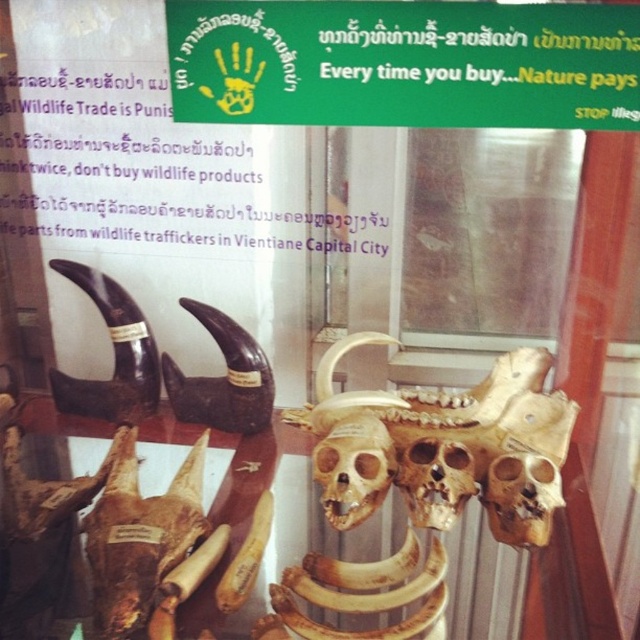
Question: Which point is farther to the camera?

Choices:
 (A) brown matte skull at center
 (B) golden bone skull at center

Answer: (A)

Question: Is golden bone skull at center to the left of brown matte skull at center from the viewer's perspective?

Choices:
 (A) no
 (B) yes

Answer: (A)

Question: Does golden bone skull at center have a lesser width compared to brown matte skull at center?

Choices:
 (A) no
 (B) yes

Answer: (A)

Question: Which of the following is the closest to the observer?

Choices:
 (A) brown matte skull at center
 (B) golden bone skull at center

Answer: (B)

Question: Where is golden bone skull at center located in relation to brown matte skull at center in the image?

Choices:
 (A) above
 (B) below

Answer: (A)

Question: Which point appears closest to the camera in this image?

Choices:
 (A) (374, 586)
 (B) (348, 492)

Answer: (B)